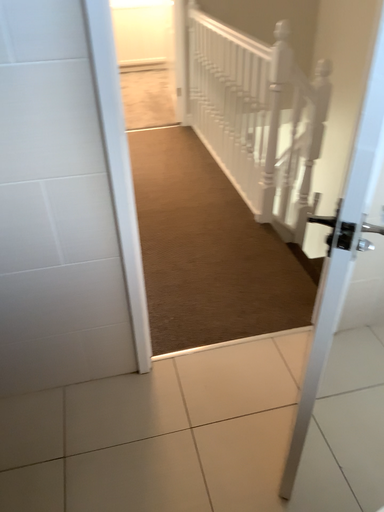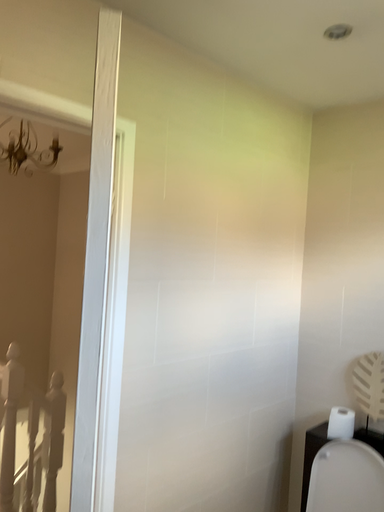
Question: How did the camera likely rotate when shooting the video?

Choices:
 (A) rotated left
 (B) rotated right

Answer: (B)